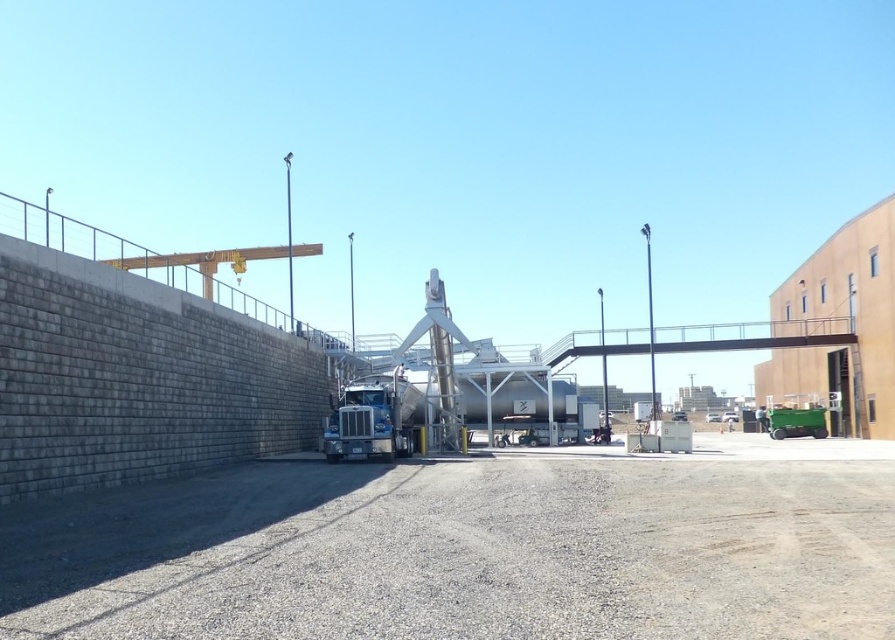
You are standing at the center of the industrial area and want to locate the gray concrete wall at left. According to the coordinates provided, in which direction should you look to find it?

The gray concrete wall at left is located at coordinates point (473, 548), which means you should look to your left side to find it.

You are a delivery driver approaching the industrial site. You need to park your silver metallic trailer truck at center between the gray concrete wall at left and the building on the right. Can you fit the truck between them?

The gray concrete wall at left is bigger than the silver metallic trailer truck at center, but the question is about fitting between the wall and the building. Since the description only compares their sizes and not the distance between them, we cannot determine if the truck will fit. More information about the space between the wall and the building is needed.

Consider the image. You are a delivery driver approaching the industrial site. Your truck has a length of 25 feet. You need to park your truck between the gray concrete wall at left and the silver metallic trailer truck at center. Is there enough space for your truck to fit between them?

The gray concrete wall at left is 28.53 feet away from the silver metallic trailer truck at center. Since your truck is 25 feet long, there is sufficient space between them to park your truck as the distance is greater than the truck length.